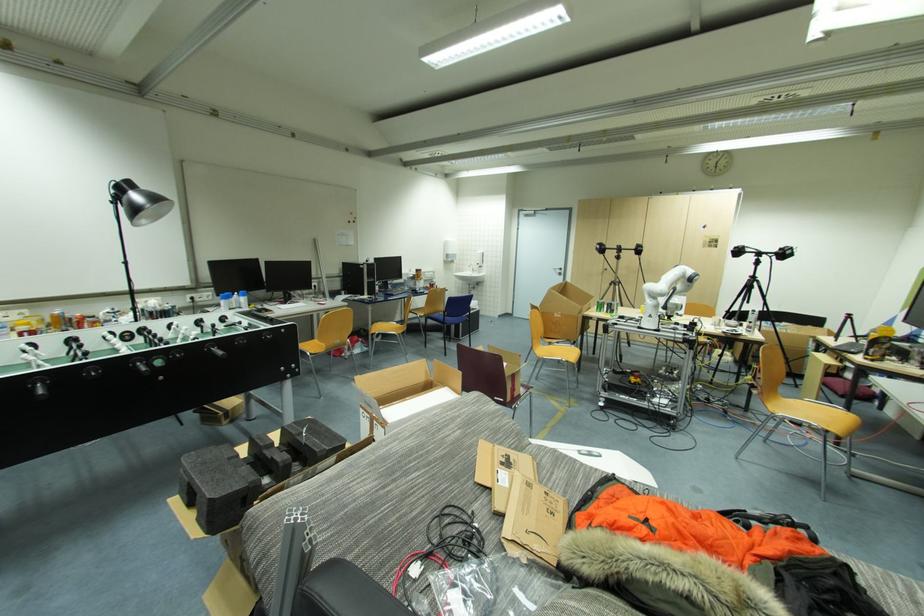
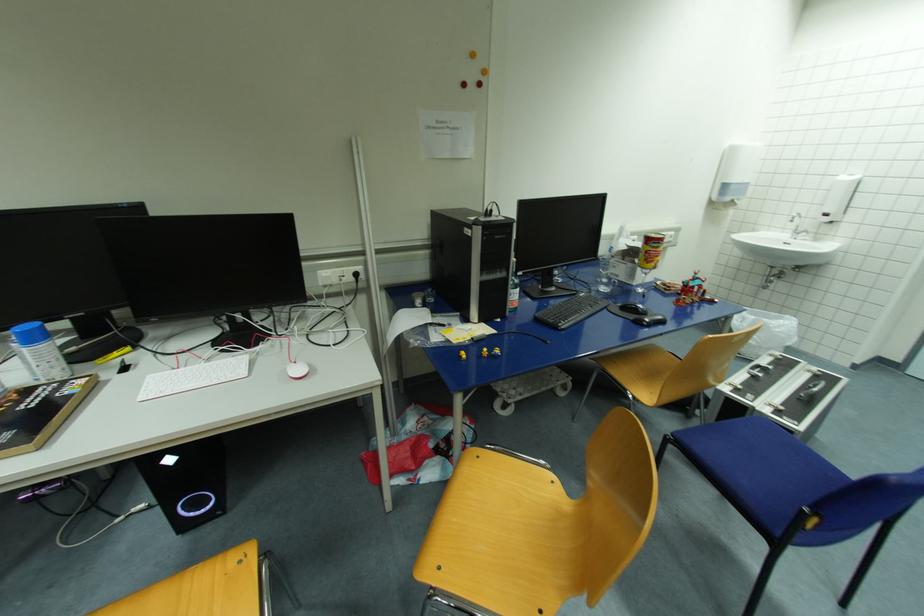
In the second image, find the point that corresponds to (x=420, y=272) in the first image.

(653, 241)